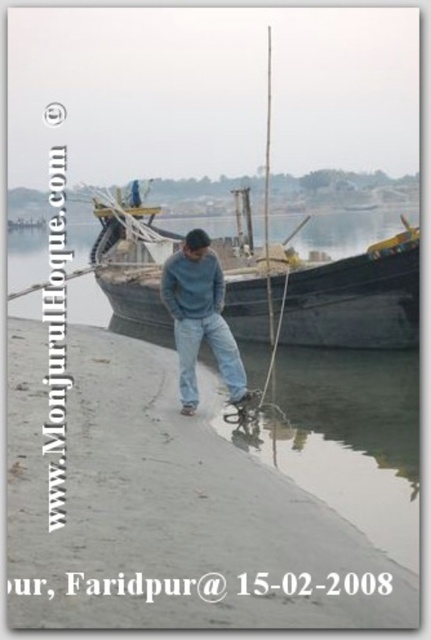
At what (x,y) coordinates should I click in order to perform the action: click on wooden boat at center. Please return your answer as a coordinate pair (x, y). The width and height of the screenshot is (431, 640). Looking at the image, I should click on (353, 298).

Is wooden boat at center positioned in front of matte blue jeans at center?

Yes, wooden boat at center is closer to the viewer.

Does point (233, 237) lie in front of point (224, 371)?

No, (233, 237) is behind (224, 371).

Where is `wooden boat at center`? wooden boat at center is located at coordinates point(353,298).

This screenshot has width=431, height=640. Describe the element at coordinates (353, 298) in the screenshot. I see `wooden boat at center` at that location.

Between wooden boat at center and denim jeans at center, which one is positioned higher?

wooden boat at center

Which is in front, point (356, 284) or point (190, 390)?

Point (190, 390) is more forward.

Find the location of a particular element. The height and width of the screenshot is (640, 431). wooden boat at center is located at coordinates (353, 298).

Is smooth concrete shore at center above matte blue jeans at center?

No, smooth concrete shore at center is not above matte blue jeans at center.

Which is behind, point (175, 548) or point (175, 310)?

Point (175, 310)

At what (x,y) coordinates should I click in order to perform the action: click on smooth concrete shore at center. Please return your answer as a coordinate pair (x, y). Image resolution: width=431 pixels, height=640 pixels. Looking at the image, I should click on (169, 512).

Where is `smooth concrete shore at center`? This screenshot has width=431, height=640. smooth concrete shore at center is located at coordinates (169, 512).